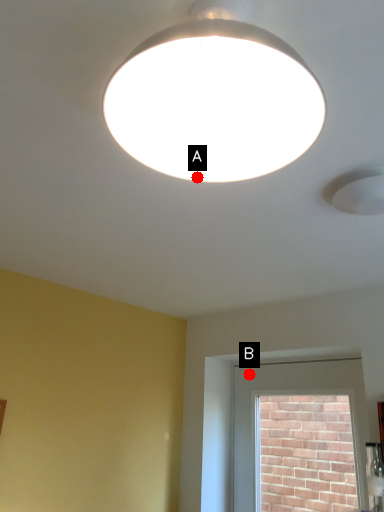
Question: Two points are circled on the image, labeled by A and B beside each circle. Among these points, which one is farthest from the camera?

Choices:
 (A) A is further
 (B) B is further

Answer: (B)